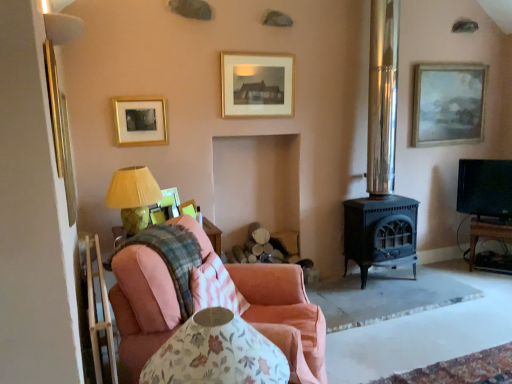
Question: Considering the relative positions of pink fabric chair at lower left and black glossy tv at right in the image provided, is pink fabric chair at lower left behind black glossy tv at right?

Choices:
 (A) no
 (B) yes

Answer: (A)

Question: Could you tell me if pink fabric chair at lower left is turned towards black glossy tv at right?

Choices:
 (A) no
 (B) yes

Answer: (B)

Question: Does pink fabric chair at lower left contain black glossy tv at right?

Choices:
 (A) yes
 (B) no

Answer: (B)

Question: Is pink fabric chair at lower left beside black glossy tv at right?

Choices:
 (A) yes
 (B) no

Answer: (B)

Question: Is pink fabric chair at lower left taller than black glossy tv at right?

Choices:
 (A) yes
 (B) no

Answer: (A)

Question: From a real-world perspective, is pink fabric couch at lower left above or below black glossy tv at right?

Choices:
 (A) above
 (B) below

Answer: (B)

Question: In terms of height, does pink fabric couch at lower left look taller or shorter compared to black glossy tv at right?

Choices:
 (A) tall
 (B) short

Answer: (A)

Question: Is pink fabric couch at lower left bigger or smaller than black glossy tv at right?

Choices:
 (A) small
 (B) big

Answer: (B)

Question: Would you say pink fabric couch at lower left is to the left or to the right of black glossy tv at right in the picture?

Choices:
 (A) right
 (B) left

Answer: (B)

Question: Considering the positions of matte gold picture frame at upper right, the 1th picture frame when ordered from back to front, and gold/glossy picture frame at upper left, which is the 3th picture frame from front to back, in the image, is matte gold picture frame at upper right, the 1th picture frame when ordered from back to front, wider or thinner than gold/glossy picture frame at upper left, which is the 3th picture frame from front to back,?

Choices:
 (A) wide
 (B) thin

Answer: (A)

Question: Which is correct: matte gold picture frame at upper right, which is the 1th picture frame from right to left, is inside gold/glossy picture frame at upper left, the second picture frame positioned from the left, or outside of it?

Choices:
 (A) outside
 (B) inside

Answer: (A)

Question: Is point (474, 100) positioned closer to the camera than point (153, 102)?

Choices:
 (A) closer
 (B) farther

Answer: (B)

Question: Based on their positions, is matte gold picture frame at upper right, which is the 5th picture frame from front to back, located to the left or right of gold/glossy picture frame at upper left, placed as the third picture frame when sorted from back to front?

Choices:
 (A) right
 (B) left

Answer: (A)

Question: Is pink fabric couch at lower left spatially inside matte yellow fabric at left, or outside of it?

Choices:
 (A) inside
 (B) outside

Answer: (B)

Question: Based on their positions, is pink fabric couch at lower left located to the left or right of matte yellow fabric at left?

Choices:
 (A) left
 (B) right

Answer: (B)